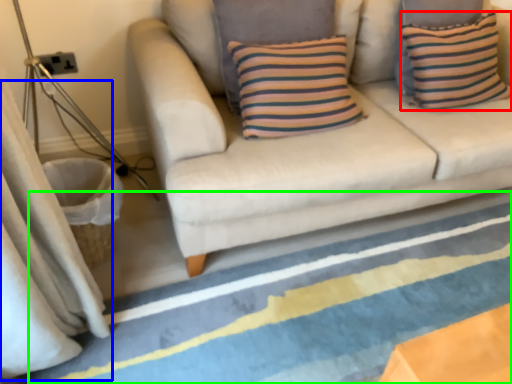
Question: Which object is positioned farthest from pillow (highlighted by a red box)? Select from curtain (highlighted by a blue box) and strip (highlighted by a green box).

Choices:
 (A) curtain
 (B) strip

Answer: (A)